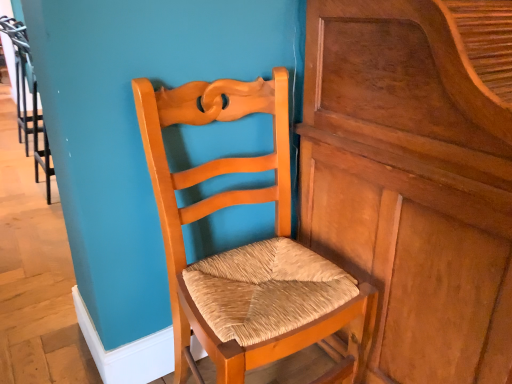
Question: Is wooden polished dresser at center outside of matte wood chair at center?

Choices:
 (A) yes
 (B) no

Answer: (A)

Question: Considering the relative sizes of wooden polished dresser at center and matte wood chair at center in the image provided, is wooden polished dresser at center shorter than matte wood chair at center?

Choices:
 (A) yes
 (B) no

Answer: (B)

Question: From the image's perspective, does wooden polished dresser at center appear higher than matte wood chair at center?

Choices:
 (A) no
 (B) yes

Answer: (B)

Question: Is wooden polished dresser at center thinner than matte wood chair at center?

Choices:
 (A) no
 (B) yes

Answer: (A)

Question: Does wooden polished dresser at center have a greater height compared to matte wood chair at center?

Choices:
 (A) yes
 (B) no

Answer: (A)

Question: From a real-world perspective, is wooden polished dresser at center over matte wood chair at center?

Choices:
 (A) no
 (B) yes

Answer: (B)

Question: Can you confirm if matte wood chair at center is wider than wooden polished dresser at center?

Choices:
 (A) yes
 (B) no

Answer: (B)

Question: From the image's perspective, would you say matte wood chair at center is positioned over wooden polished dresser at center?

Choices:
 (A) yes
 (B) no

Answer: (B)

Question: Is matte wood chair at center thinner than wooden polished dresser at center?

Choices:
 (A) yes
 (B) no

Answer: (A)

Question: Is matte wood chair at center further to camera compared to wooden polished dresser at center?

Choices:
 (A) yes
 (B) no

Answer: (A)

Question: Does matte wood chair at center have a larger size compared to wooden polished dresser at center?

Choices:
 (A) yes
 (B) no

Answer: (B)

Question: Is the depth of matte wood chair at center less than that of wooden polished dresser at center?

Choices:
 (A) no
 (B) yes

Answer: (A)

Question: Is wooden polished dresser at center inside or outside of matte wood chair at center?

Choices:
 (A) inside
 (B) outside

Answer: (B)